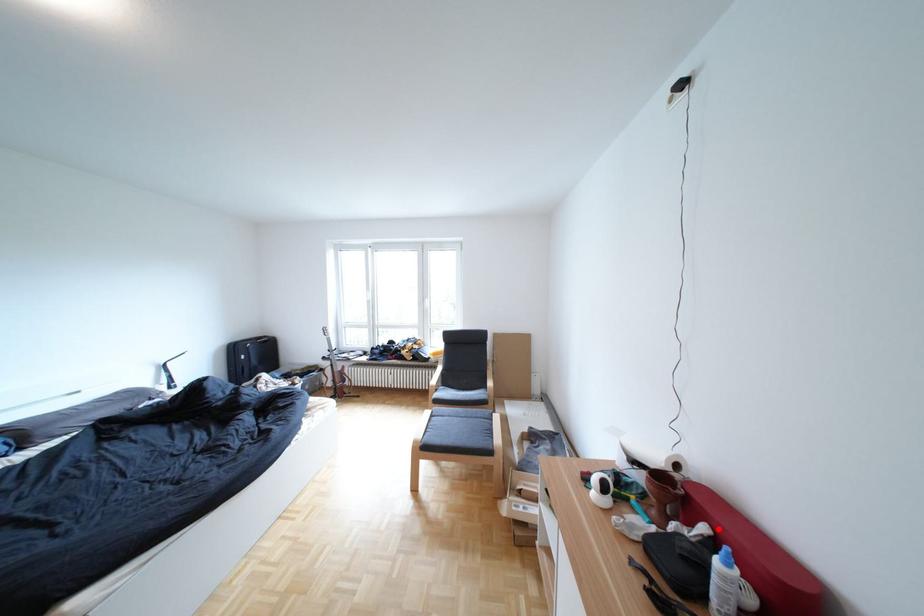
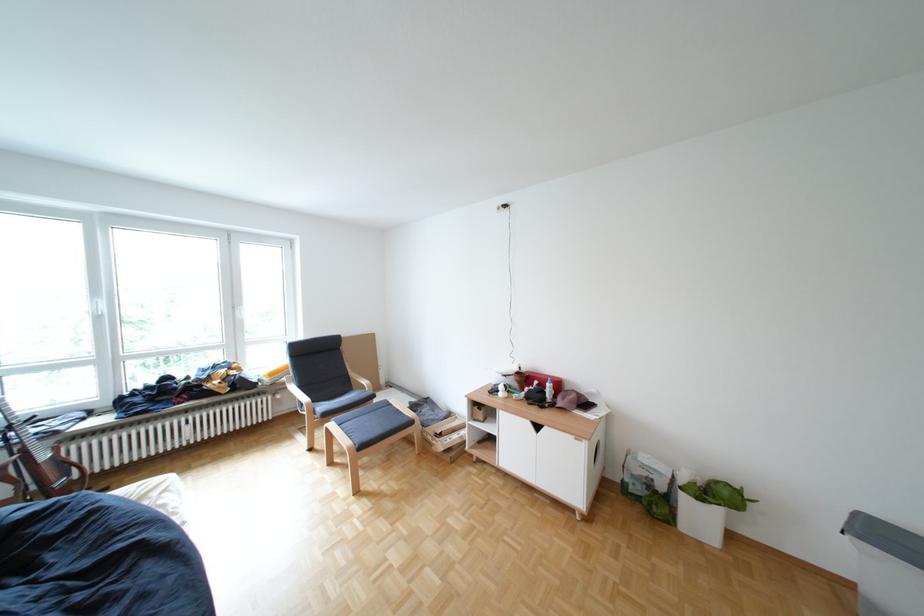
The point at the highlighted location is marked in the first image. Where is the corresponding point in the second image?

(552, 383)